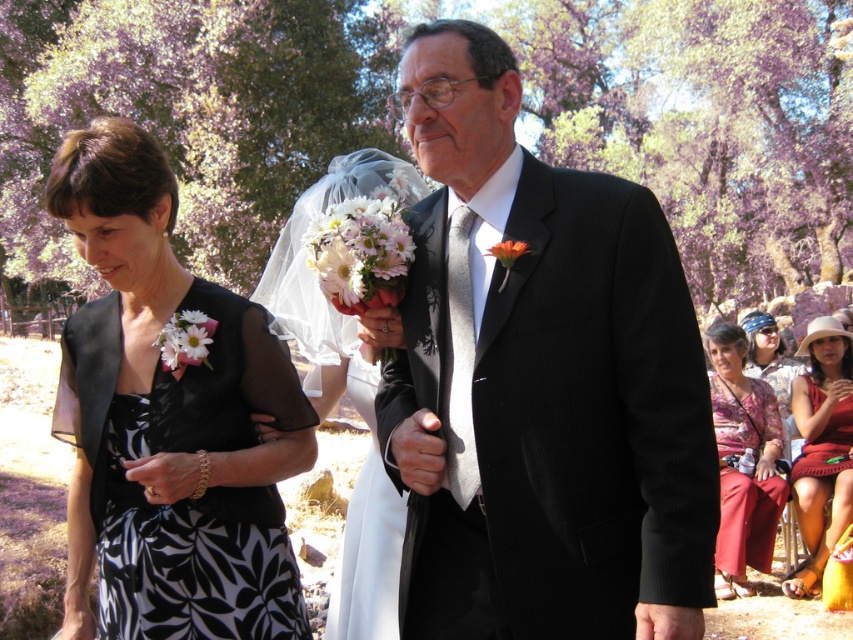
You are a photographer at a wedding, and you want to focus your camera on the white matte bouquet at center. However, the matte black suit at center is blocking your view. Can you adjust your position so that the bouquet is visible without the suit blocking it?

The matte black suit at center is closer to the viewer than the white matte bouquet at center. Therefore, moving your position to either side of the bouquet might allow you to see it around the suit, but since the suit is in front, you would need to move around it to fully capture the bouquet without obstruction.

In the scene shown: You are standing at the point with coordinates point (206, 358) and want to walk towards the point with coordinates point (448, 401). Which direction should you move to reach your destination?

You should move forward because point (448, 401) is in front of point (206, 358).